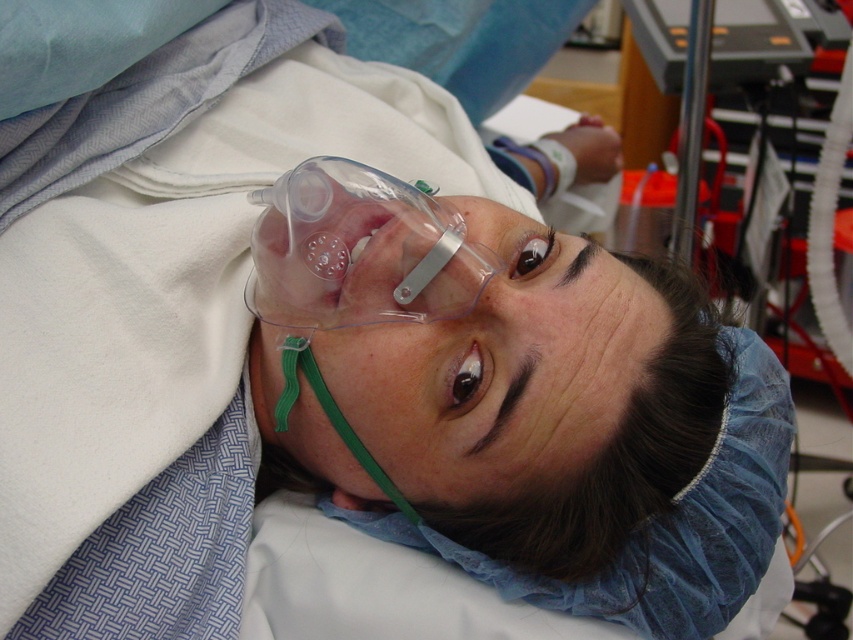
Which is above, transparent plastic mask at center or metallic silver oxygen tank at upper right?

metallic silver oxygen tank at upper right is above.

Does transparent plastic mask at center have a lesser height compared to metallic silver oxygen tank at upper right?

Yes, transparent plastic mask at center is shorter than metallic silver oxygen tank at upper right.

Identify the location of transparent plastic mask at center. The height and width of the screenshot is (640, 853). (358, 250).